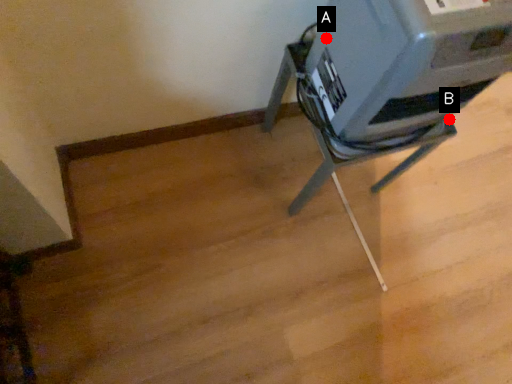
Question: Two points are circled on the image, labeled by A and B beside each circle. Which point is farther from the camera taking this photo?

Choices:
 (A) A is further
 (B) B is further

Answer: (B)